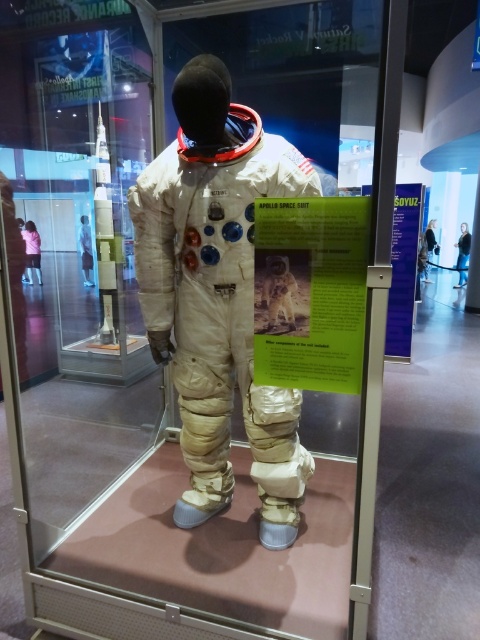
You are an astronaut preparing for a spacewalk and need to attach a green paper at center and a purple paper at right to your spacesuit. Which paper should you choose if you want the one that is larger?

The purple paper at right is larger than the green paper at center, so you should choose the purple paper at right.

You are a museum visitor looking at the Apollo space suit display. You notice two pieces of paper near the glass case. One is green paper at center and the other is purple paper at right. Which paper is located to the left of the other?

The green paper at center is positioned on the left side of purple paper at right.